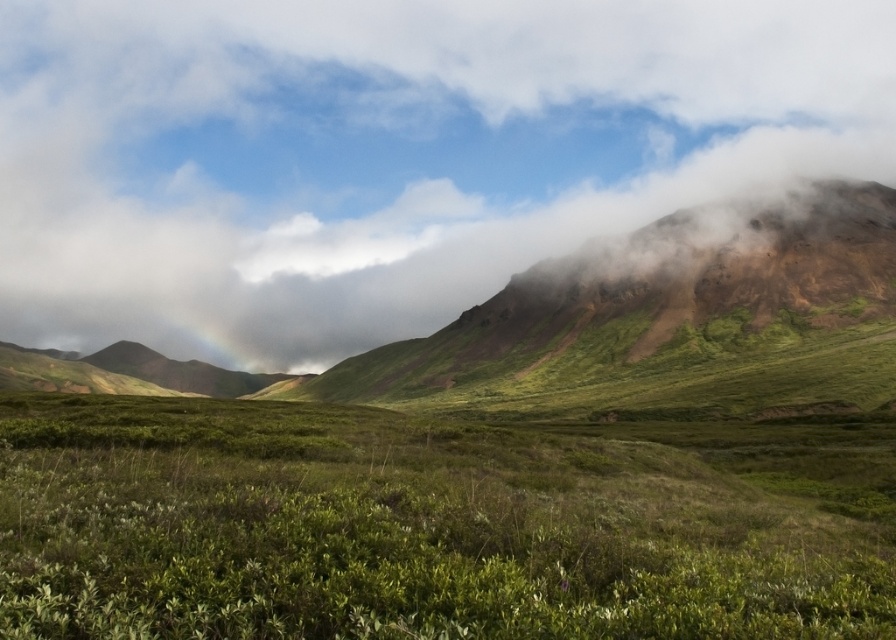
Question: Which point is closer to the camera?

Choices:
 (A) green matte grass at center
 (B) white fluffy cloud at upper center

Answer: (A)

Question: Is white fluffy cloud at upper center wider than green matte grass at center?

Choices:
 (A) no
 (B) yes

Answer: (B)

Question: Observing the image, what is the correct spatial positioning of white fluffy cloud at upper center in reference to green matte grass at center?

Choices:
 (A) above
 (B) below

Answer: (A)

Question: Which of the following is the closest to the observer?

Choices:
 (A) green matte grass at center
 (B) white fluffy cloud at upper center

Answer: (A)

Question: Which object is closer to the camera taking this photo?

Choices:
 (A) green matte grass at center
 (B) white fluffy cloud at upper center

Answer: (A)

Question: Is white fluffy cloud at upper center to the left of green matte grass at center from the viewer's perspective?

Choices:
 (A) no
 (B) yes

Answer: (B)